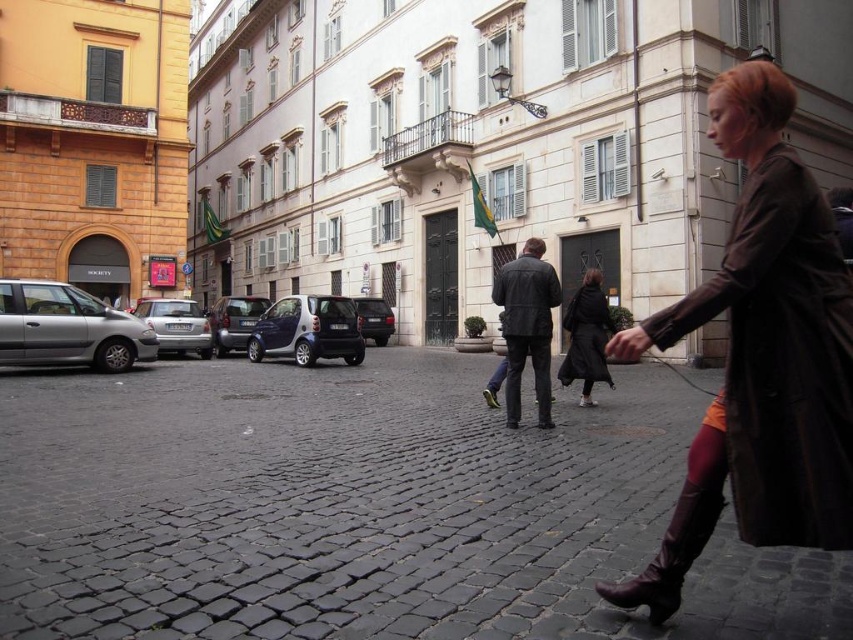
Question: Is dark brown leather jacket at center wider than leather jacket at center?

Choices:
 (A) yes
 (B) no

Answer: (B)

Question: Which object is positioned farthest from the silver metallic car at left?

Choices:
 (A) cobblestone pavement at center
 (B) brown matte hair at center

Answer: (B)

Question: Estimate the real-world distances between objects in this image. Which object is closer to the dark brown leather jacket at center?

Choices:
 (A) dark gray matte car at center
 (B) silver metallic car at left

Answer: (A)

Question: Does leather boots at lower right come in front of silver metallic car at left?

Choices:
 (A) yes
 (B) no

Answer: (A)

Question: Can you confirm if silver metallic van at left is positioned above dark gray matte car at center?

Choices:
 (A) yes
 (B) no

Answer: (A)

Question: Which point is farther to the camera?

Choices:
 (A) (105, 340)
 (B) (791, 102)
 (C) (674, 520)

Answer: (A)